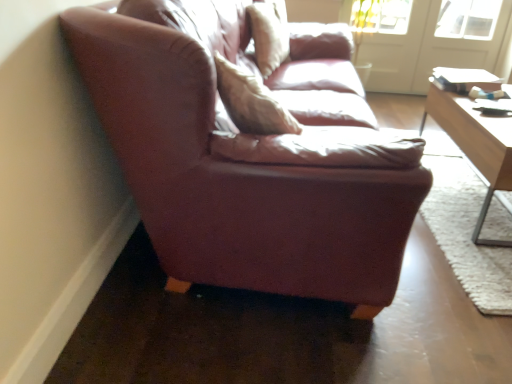
From a real-world perspective, locate several points in the blank space situated above white glass screen door at upper right, which is counted as the second screen door, starting from the right. Your answer should be formatted as a list of tuples, i.e. [(x1, y1)], where each tuple contains the x and y coordinates of a point satisfying the conditions above.

[(0.792, -0.000)]